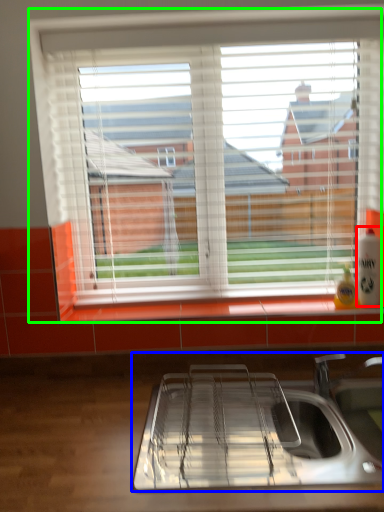
Question: Considering the real-world distances, which object is farthest from beverage (highlighted by a red box)? sink (highlighted by a blue box) or window (highlighted by a green box)?

Choices:
 (A) sink
 (B) window

Answer: (B)